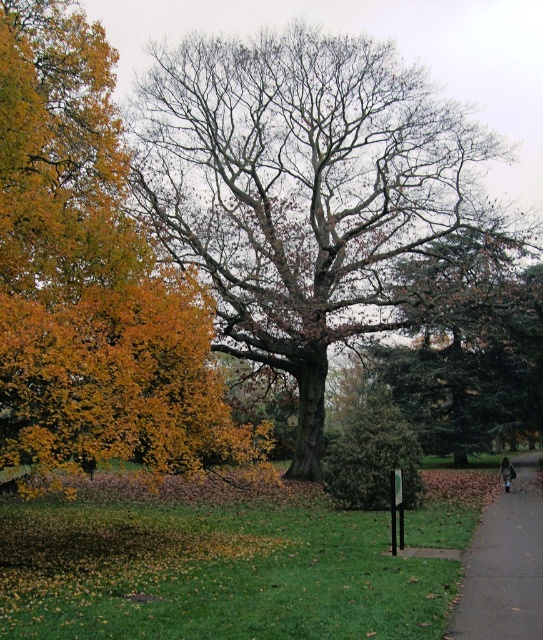
Between point (156, 100) and point (531, 545), which one is positioned in front?

Point (531, 545) is in front.

Is point (444, 124) more distant than point (485, 541)?

Yes, point (444, 124) is farther from viewer.

Does point (224, 100) come behind point (459, 625)?

Yes, it is.

The image size is (543, 640). Identify the location of bare wood oak tree at center. (305, 193).

Who is positioned more to the left, bare wood oak tree at center or golden yellow leaves at left?

Positioned to the left is golden yellow leaves at left.

Can you confirm if bare wood oak tree at center is positioned to the right of golden yellow leaves at left?

Indeed, bare wood oak tree at center is positioned on the right side of golden yellow leaves at left.

You are a GUI agent. You are given a task and a screenshot of the screen. Output one action in this format:
    pyautogui.click(x=<x>, y=<y>)
    Task: Click on the bare wood oak tree at center
    The width and height of the screenshot is (543, 640).
    Given the screenshot: What is the action you would take?
    pyautogui.click(x=305, y=193)

The width and height of the screenshot is (543, 640). What are the coordinates of `bare wood oak tree at center` in the screenshot? It's located at (305, 193).

In the scene shown: Does golden yellow leaves at left have a lesser width compared to gray concrete pavement at lower right?

Yes, golden yellow leaves at left is thinner than gray concrete pavement at lower right.

Is golden yellow leaves at left to the left of gray concrete pavement at lower right from the viewer's perspective?

Indeed, golden yellow leaves at left is positioned on the left side of gray concrete pavement at lower right.

What do you see at coordinates (93, 280) in the screenshot? This screenshot has width=543, height=640. I see `golden yellow leaves at left` at bounding box center [93, 280].

Locate an element on the screen. This screenshot has width=543, height=640. golden yellow leaves at left is located at coordinates (93, 280).